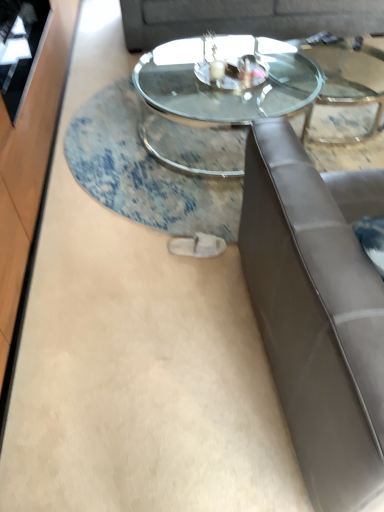
Question: Would you say transparent glass coffee table at center is to the left or to the right of suede gray couch at upper center in the picture?

Choices:
 (A) right
 (B) left

Answer: (B)

Question: In terms of height, does transparent glass coffee table at center look taller or shorter compared to suede gray couch at upper center?

Choices:
 (A) short
 (B) tall

Answer: (A)

Question: Estimate the real-world distances between objects in this image. Which object is closer to the transparent glass coffee table at center?

Choices:
 (A) transparent glass door at left
 (B) suede gray couch at upper center
 (C) satin brown leather studio couch at right

Answer: (B)

Question: Which object is the farthest from the transparent glass door at left?

Choices:
 (A) satin brown leather studio couch at right
 (B) suede gray couch at upper center
 (C) transparent glass coffee table at center

Answer: (A)